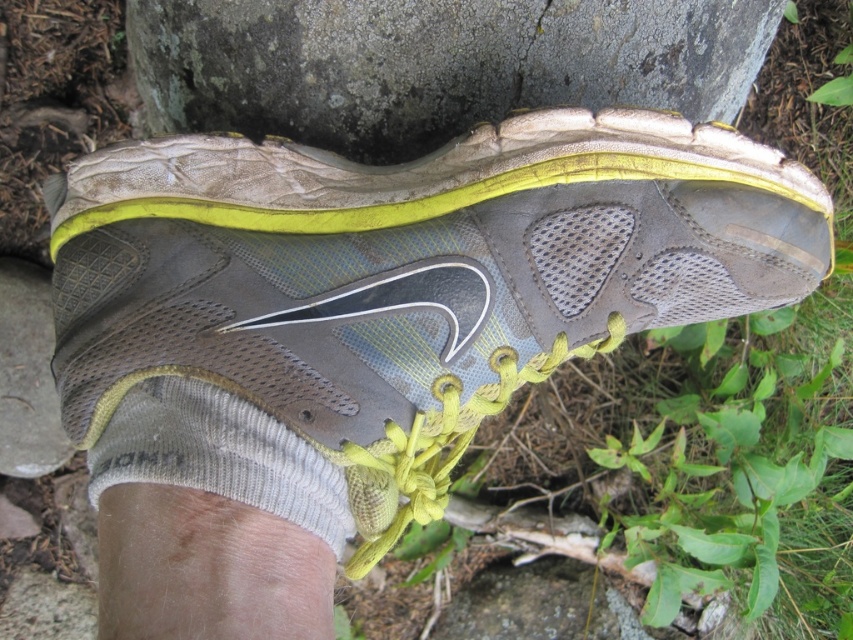
Question: Is matte gray running shoe at center to the left of gray rough stone at center from the viewer's perspective?

Choices:
 (A) no
 (B) yes

Answer: (A)

Question: Which of the following is the closest to the observer?

Choices:
 (A) gray rough stone at center
 (B) matte gray running shoe at center

Answer: (B)

Question: Which point appears closest to the camera in this image?

Choices:
 (A) (735, 58)
 (B) (294, 211)

Answer: (B)

Question: Which of the following is the closest to the observer?

Choices:
 (A) (350, 288)
 (B) (732, 99)

Answer: (A)

Question: Is matte gray running shoe at center thinner than gray rough stone at center?

Choices:
 (A) yes
 (B) no

Answer: (A)

Question: Is matte gray running shoe at center to the left of gray rough stone at center from the viewer's perspective?

Choices:
 (A) no
 (B) yes

Answer: (A)